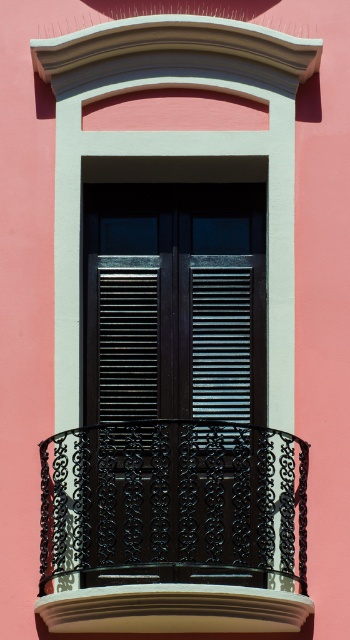
You are standing in front of the building and want to determine which of the two points, point (143, 394) or point (206, 284), is closer to you. Based on the scene description, which point is nearer?

Point (143, 394) is closer to the viewer than point (206, 284).

You are standing in front of the building and want to place a potted plant on the black wrought iron balcony at center. To ensure it doesn not fall off, you need to know if the balcony is above or below the metallic dark gray shutter at center. Which is it?

The black wrought iron balcony at center is positioned under the metallic dark gray shutter at center, so the balcony is below the shutter. Therefore, placing the plant there should be safe as it won not interfere with the shutter.